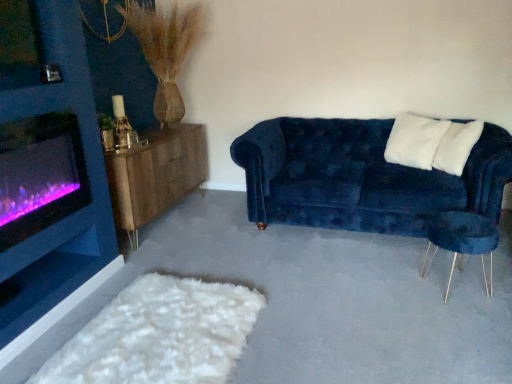
I want to click on vacant space underneath velvet blue armchair at right (from a real-world perspective), so click(x=455, y=283).